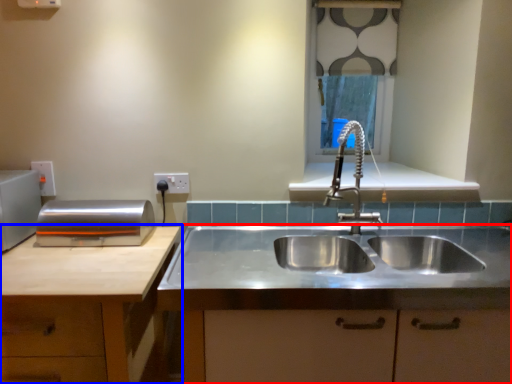
Question: Which object appears farthest to the camera in this image, countertop (highlighted by a red box) or cabinetry (highlighted by a blue box)?

Choices:
 (A) countertop
 (B) cabinetry

Answer: (A)